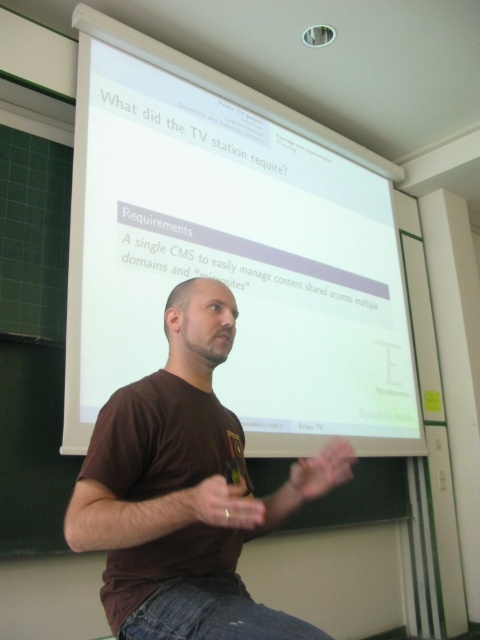
Does point (115, 340) lie in front of point (304, 496)?

No.

Which is below, white matte projection screen at upper center or matte brown hand at lower center?

matte brown hand at lower center is below.

Is point (340, 317) positioned before point (296, 474)?

No, it is behind (296, 474).

Locate an element on the screen. This screenshot has height=640, width=480. white matte projection screen at upper center is located at coordinates (232, 252).

Is point (350, 429) closer to viewer compared to point (96, 529)?

No, (350, 429) is further to viewer.

Locate an element on the screen. This screenshot has height=640, width=480. white matte projection screen at upper center is located at coordinates (232, 252).

Is point (176, 444) closer to camera compared to point (337, 452)?

Yes, point (176, 444) is in front of point (337, 452).

Between brown cotton shirt at center and matte brown hand at lower center, which one has more height?

Standing taller between the two is brown cotton shirt at center.

The width and height of the screenshot is (480, 640). I want to click on brown cotton shirt at center, so click(x=173, y=492).

This screenshot has height=640, width=480. I want to click on brown cotton shirt at center, so click(x=173, y=492).